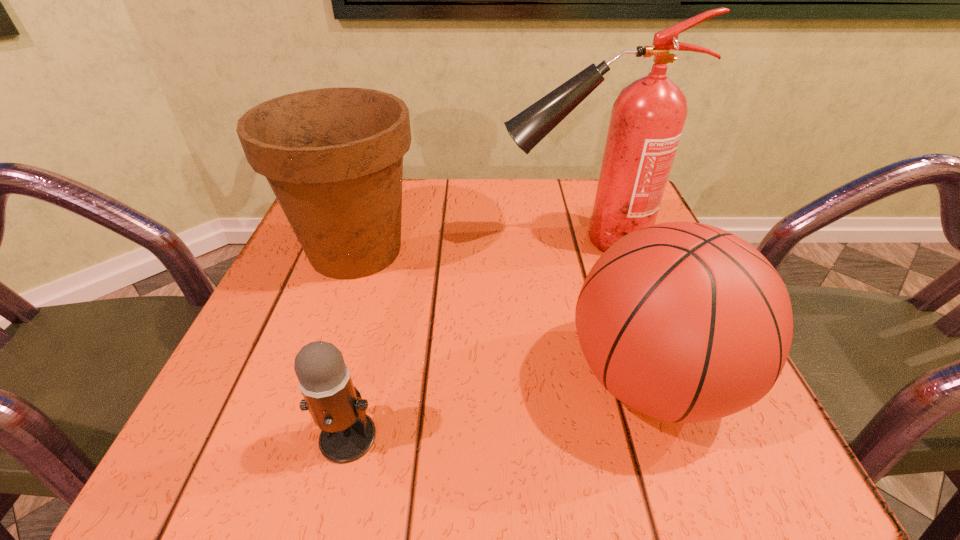
You are a GUI agent. You are given a task and a screenshot of the screen. Output one action in this format:
    pyautogui.click(x=<x>, y=<y>)
    Task: Click on the vacant space that satisfies the following two spatial constraints: 1. at the nozzle end of the basketball; 2. on the left side of the fire extinguisher
    The width and height of the screenshot is (960, 540).
    Given the screenshot: What is the action you would take?
    pyautogui.click(x=621, y=380)

Image resolution: width=960 pixels, height=540 pixels. What are the coordinates of `vacant space that satisfies the following two spatial constraints: 1. on the back side of the basketball; 2. at the nozzle end of the tallest object` in the screenshot? It's located at (602, 241).